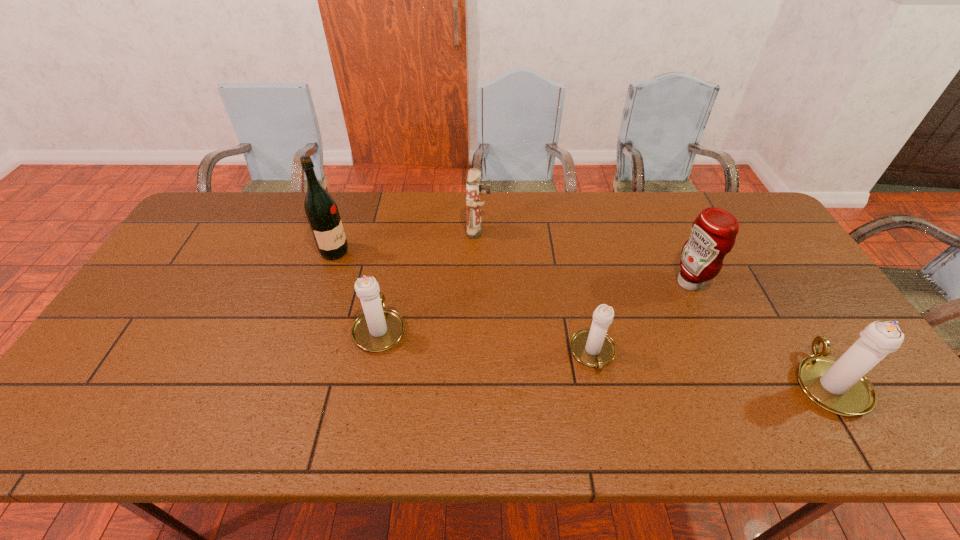
The height and width of the screenshot is (540, 960). What are the coordinates of `vacant space located 0.260m on the left of the third farthest object` in the screenshot? It's located at (585, 283).

The image size is (960, 540). Identify the location of object that is at the far edge. (473, 204).

Find the location of a particular element. This screenshot has width=960, height=540. object situated at the right edge is located at coordinates (839, 385).

Where is `object located in the near right corner section of the desktop`? object located in the near right corner section of the desktop is located at coordinates (839, 385).

In the image, there is a desktop. Identify the location of vacant area at the far edge. (579, 208).

You are a GUI agent. You are given a task and a screenshot of the screen. Output one action in this format:
    pyautogui.click(x=<x>, y=<y>)
    Task: Click on the vacant area at the near edge
    The width and height of the screenshot is (960, 540).
    Given the screenshot: What is the action you would take?
    pyautogui.click(x=792, y=387)

In the image, there is a desktop. In order to click on vacant area at the left edge in this screenshot , I will do `click(127, 346)`.

You are a GUI agent. You are given a task and a screenshot of the screen. Output one action in this format:
    pyautogui.click(x=<x>, y=<y>)
    Task: Click on the free point at the right edge
    
    Given the screenshot: What is the action you would take?
    pyautogui.click(x=797, y=266)

I want to click on free spot between the figurine and the second candle holder from right to left, so click(x=536, y=293).

What are the coordinates of `free spot between the figurine and the liquor` in the screenshot? It's located at (407, 242).